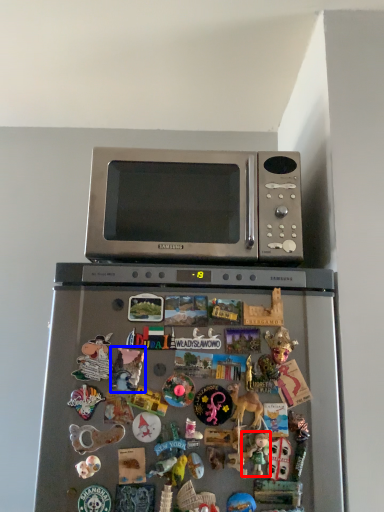
Question: Among these objects, which one is farthest to the camera, toy (highlighted by a red box) or toy (highlighted by a blue box)?

Choices:
 (A) toy
 (B) toy

Answer: (B)